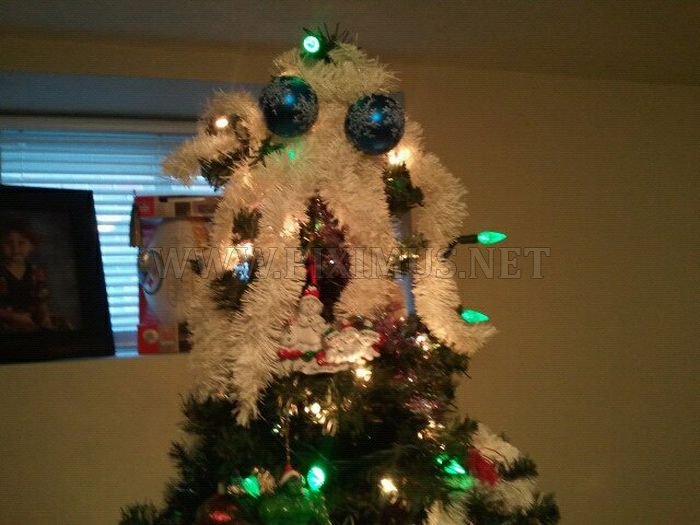
At what (x,y) coordinates should I click in order to perform the action: click on christmas tree. Please return your answer as a coordinate pair (x, y). The image size is (700, 525). Looking at the image, I should click on (202, 446).